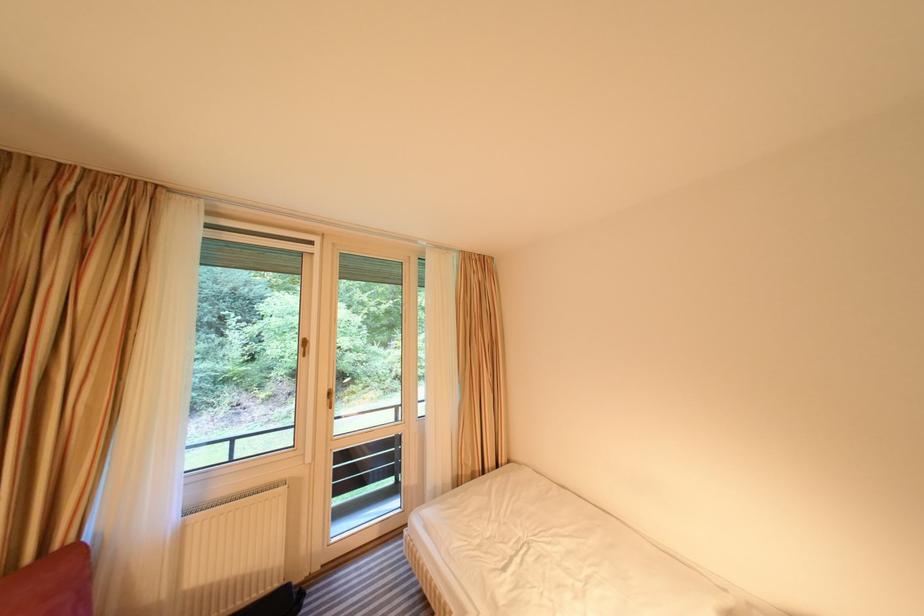
The width and height of the screenshot is (924, 616). I want to click on red chair armrest, so click(51, 585).